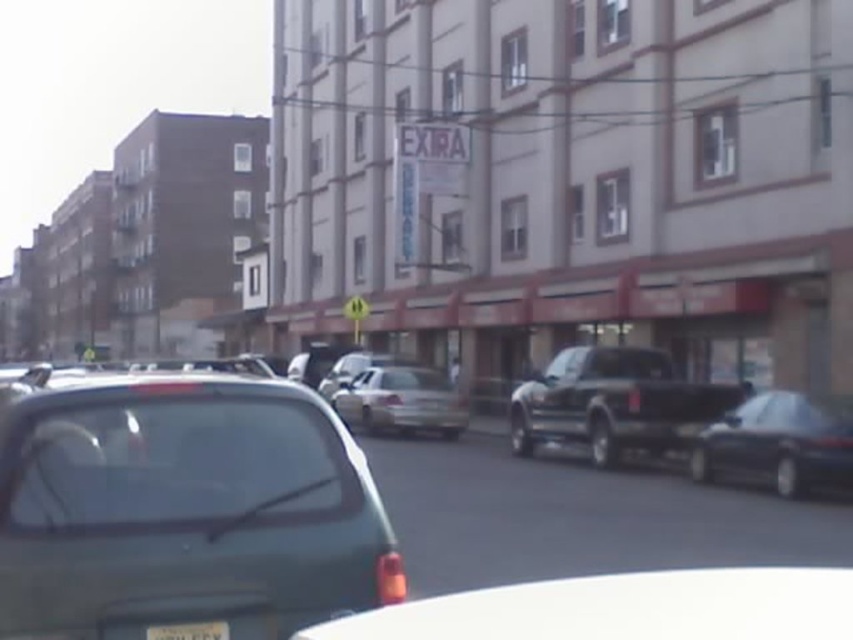
Question: Estimate the real-world distances between objects in this image. Which object is closer to the metallic silver sedan at center?

Choices:
 (A) shiny black sedan at center
 (B) silver metallic sedan at center
 (C) white plastic license plate at center
 (D) black matte truck at center

Answer: (B)

Question: Which object is positioned farthest from the black matte truck at center?

Choices:
 (A) shiny black sedan at center
 (B) white plastic license plate at center
 (C) silver metallic sedan at center

Answer: (B)

Question: From the image, what is the correct spatial relationship of shiny black sedan at center in relation to white plastic license plate at center?

Choices:
 (A) right
 (B) left

Answer: (A)

Question: Is black matte truck at center bigger than shiny black sedan at center?

Choices:
 (A) yes
 (B) no

Answer: (B)

Question: Does silver metallic sedan at center appear on the right side of metallic silver sedan at center?

Choices:
 (A) no
 (B) yes

Answer: (B)

Question: Estimate the real-world distances between objects in this image. Which object is closer to the shiny black sedan at center?

Choices:
 (A) silver metallic sedan at center
 (B) metallic silver sedan at center
 (C) white plastic license plate at center

Answer: (A)